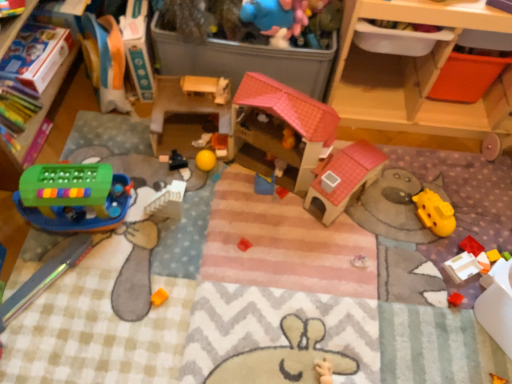
This screenshot has height=384, width=512. What are the coordinates of `vacant area that lies between green plastic boat at left, the ninth toy viewed from the right, and yellow plastic spoon at center, the 7th toy when ordered from left to right` in the screenshot? It's located at [x=202, y=201].